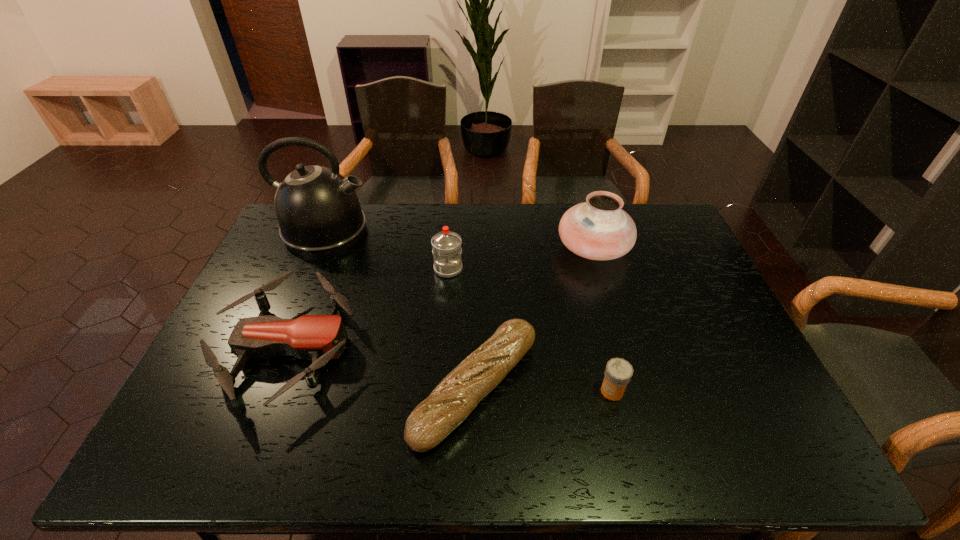
You are a GUI agent. You are given a task and a screenshot of the screen. Output one action in this format:
    pyautogui.click(x=<x>, y=<y>)
    Task: Click on the free space at the far edge of the desktop
    Image resolution: width=960 pixels, height=540 pixels.
    Given the screenshot: What is the action you would take?
    pyautogui.click(x=495, y=228)

Identify the location of free space at the near edge. The width and height of the screenshot is (960, 540). (369, 461).

Image resolution: width=960 pixels, height=540 pixels. Identify the location of free space at the left edge of the desktop. [262, 362].

Find the location of a particular element. The height and width of the screenshot is (540, 960). blank space at the far right corner is located at coordinates (635, 212).

Identify the location of vacant area that lies between the medicine and the drone. (450, 369).

Identify the location of free space that is in between the medicine and the baguet. The height and width of the screenshot is (540, 960). (543, 389).

This screenshot has width=960, height=540. Find the location of `unoccupied position between the drone and the baguet`. unoccupied position between the drone and the baguet is located at coordinates (381, 368).

You are a GUI agent. You are given a task and a screenshot of the screen. Output one action in this format:
    pyautogui.click(x=<x>, y=<y>)
    Task: Click on the vacant space that is in between the pottery and the medicine
    The image size is (960, 540).
    Given the screenshot: What is the action you would take?
    pyautogui.click(x=603, y=320)

Find the location of a particular element. The height and width of the screenshot is (540, 960). free spot between the medicine and the drone is located at coordinates (450, 369).

The height and width of the screenshot is (540, 960). I want to click on vacant space that is in between the baguet and the tallest object, so click(x=400, y=309).